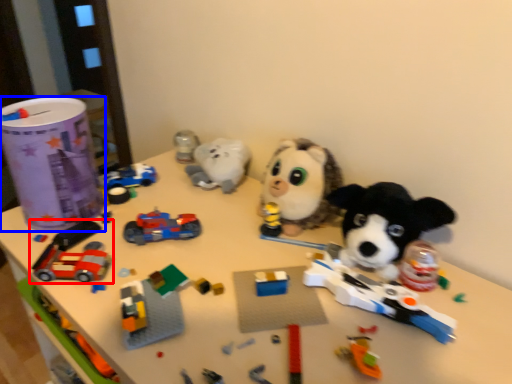
Question: Which object appears farthest to the camera in this image, toy (highlighted by a red box) or toy (highlighted by a blue box)?

Choices:
 (A) toy
 (B) toy

Answer: (B)